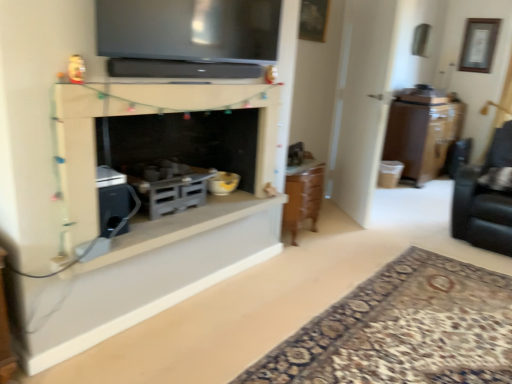
Question: From a real-world perspective, is wooden framed artwork at upper right, which is the 2th picture frame in front-to-back order, below black leather swivel chair at right?

Choices:
 (A) yes
 (B) no

Answer: (B)

Question: Is wooden framed artwork at upper right, arranged as the first picture frame when viewed from the back, not within black leather swivel chair at right?

Choices:
 (A) no
 (B) yes

Answer: (B)

Question: Considering the relative positions of wooden framed artwork at upper right, which is the 1th picture frame from top to bottom, and black leather swivel chair at right in the image provided, is wooden framed artwork at upper right, which is the 1th picture frame from top to bottom, to the left of black leather swivel chair at right from the viewer's perspective?

Choices:
 (A) yes
 (B) no

Answer: (B)

Question: Does wooden framed artwork at upper right, the second picture frame when ordered from bottom to top, contain black leather swivel chair at right?

Choices:
 (A) no
 (B) yes

Answer: (A)

Question: Does wooden framed artwork at upper right, arranged as the first picture frame when viewed from the back, have a greater width compared to black leather swivel chair at right?

Choices:
 (A) no
 (B) yes

Answer: (A)

Question: Considering the positions of white matte fireplace at center, which appears as the 2th window sill when ordered from the bottom, and matte black tv at upper center in the image, is white matte fireplace at center, which appears as the 2th window sill when ordered from the bottom, wider or thinner than matte black tv at upper center?

Choices:
 (A) wide
 (B) thin

Answer: (A)

Question: Do you think white matte fireplace at center, which appears as the 2th window sill when ordered from the bottom, is within matte black tv at upper center, or outside of it?

Choices:
 (A) inside
 (B) outside

Answer: (B)

Question: From a real-world perspective, is white matte fireplace at center, the 1th window sill in the top-to-bottom sequence, above or below matte black tv at upper center?

Choices:
 (A) above
 (B) below

Answer: (B)

Question: Is point (148, 221) positioned closer to the camera than point (147, 52)?

Choices:
 (A) farther
 (B) closer

Answer: (A)

Question: Is carpet with intricate pattern at lower right bigger or smaller than white matte fireplace at center?

Choices:
 (A) big
 (B) small

Answer: (A)

Question: Is point (308, 379) closer or farther from the camera than point (129, 87)?

Choices:
 (A) closer
 (B) farther

Answer: (B)

Question: From a real-world perspective, is carpet with intricate pattern at lower right positioned above or below white matte fireplace at center?

Choices:
 (A) below
 (B) above

Answer: (A)

Question: Considering their positions, is carpet with intricate pattern at lower right located in front of or behind white matte fireplace at center?

Choices:
 (A) front
 (B) behind

Answer: (A)

Question: Is point tap(483, 66) positioned closer to the camera than point tap(315, 6)?

Choices:
 (A) farther
 (B) closer

Answer: (A)

Question: Is wooden framed artwork at upper right, acting as the first picture frame starting from the right, in front of or behind wooden picture frame at upper center, the 2th picture frame when ordered from top to bottom, in the image?

Choices:
 (A) behind
 (B) front

Answer: (A)